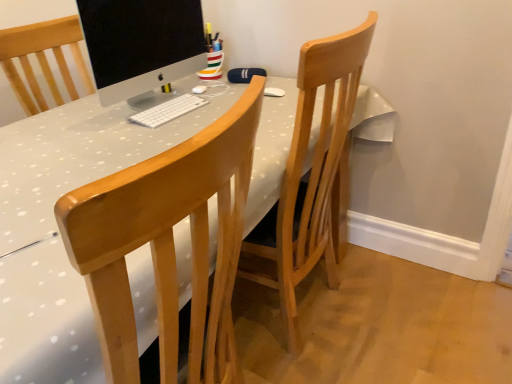
Locate an element on the screen. white matte keyboard at center is located at coordinates [168, 111].

The width and height of the screenshot is (512, 384). What do you see at coordinates (168, 111) in the screenshot? I see `white matte keyboard at center` at bounding box center [168, 111].

You are a GUI agent. You are given a task and a screenshot of the screen. Output one action in this format:
    pyautogui.click(x=<x>, y=<y>)
    Task: Click on the sleek silver monitor at center
    
    Given the screenshot: What is the action you would take?
    pyautogui.click(x=141, y=44)

From the image's perspective, which is below, sleek silver monitor at center or white matte keyboard at center?

white matte keyboard at center is shown below in the image.

Does sleek silver monitor at center appear on the right side of white matte keyboard at center?

No.

Between sleek silver monitor at center and white matte keyboard at center, which one has smaller width?

Thinner between the two is sleek silver monitor at center.

Is point (96, 69) farther from camera compared to point (132, 121)?

That is False.

From the image's perspective, is white matte keyboard at center under wooden chair at center?

No, from the image's perspective, white matte keyboard at center is not beneath wooden chair at center.

I want to click on computer keyboard that is above the wooden chair at center (from the image's perspective), so click(x=168, y=111).

Which is in front, white matte keyboard at center or wooden chair at center?

wooden chair at center is in front.

Is white matte keyboard at center looking in the opposite direction of wooden chair at center?

No, wooden chair at center is not at the back of white matte keyboard at center.

Between wooden chair at center and white matte keyboard at center, which one has smaller width?

Thinner between the two is white matte keyboard at center.

Could you tell me if wooden chair at center is turned towards white matte keyboard at center?

No, wooden chair at center is not turned towards white matte keyboard at center.

How different are the orientations of wooden chair at center and white matte keyboard at center in degrees?

The facing directions of wooden chair at center and white matte keyboard at center are 180 degrees apart.

Consider the image. How much distance is there between wooden chair at center and white matte keyboard at center?

A distance of 30.18 inches exists between wooden chair at center and white matte keyboard at center.

This screenshot has height=384, width=512. What are the coordinates of `computer monitor on the left side of wooden chair at center` in the screenshot? It's located at coord(141,44).

From a real-world perspective, which is physically below, wooden chair at center or sleek silver monitor at center?

In real-world perspective, wooden chair at center is lower.

From the picture: Considering the relative sizes of wooden chair at center and sleek silver monitor at center in the image provided, is wooden chair at center shorter than sleek silver monitor at center?

No.

Considering the relative positions of wooden chair at center and sleek silver monitor at center in the image provided, is wooden chair at center in front of sleek silver monitor at center?

Yes, it is.

From their relative heights in the image, would you say sleek silver monitor at center is taller or shorter than wooden chair at center?

sleek silver monitor at center is shorter than wooden chair at center.

Does sleek silver monitor at center appear on the right side of wooden chair at center?

Incorrect, sleek silver monitor at center is not on the right side of wooden chair at center.

Would you say sleek silver monitor at center is outside wooden chair at center?

Indeed, sleek silver monitor at center is completely outside wooden chair at center.

How different are the orientations of white matte keyboard at center and sleek silver monitor at center in degrees?

They differ by 0.000207 degrees in their facing directions.

Does white matte keyboard at center have a smaller size compared to sleek silver monitor at center?

Yes.

This screenshot has width=512, height=384. Identify the location of computer keyboard on the right of sleek silver monitor at center. (168, 111).

Can you confirm if white matte keyboard at center is wider than sleek silver monitor at center?

Correct, the width of white matte keyboard at center exceeds that of sleek silver monitor at center.

Locate an element on the screen. The height and width of the screenshot is (384, 512). computer keyboard on the right side of sleek silver monitor at center is located at coordinates (168, 111).

Locate an element on the screen. This screenshot has height=384, width=512. computer keyboard that appears on the left of wooden chair at center is located at coordinates (168, 111).

From the image, which object appears to be farther from white matte keyboard at center, sleek silver monitor at center or wooden chair at center?

wooden chair at center is positioned further to the anchor white matte keyboard at center.

Based on their spatial positions, is white matte keyboard at center or sleek silver monitor at center closer to wooden chair at center?

Based on the image, white matte keyboard at center appears to be nearer to wooden chair at center.

Based on the photo, estimate the real-world distances between objects in this image. Which object is further from sleek silver monitor at center, white matte keyboard at center or wooden chair at center?

Based on the image, wooden chair at center appears to be further to sleek silver monitor at center.

Which object lies nearer to the anchor point sleek silver monitor at center, wooden chair at center or white matte keyboard at center?

white matte keyboard at center is closer to sleek silver monitor at center.

Based on their spatial positions, is sleek silver monitor at center or white matte keyboard at center further from wooden chair at center?

sleek silver monitor at center.

Considering their positions, is wooden chair at center positioned further to white matte keyboard at center than sleek silver monitor at center?

wooden chair at center is positioned further to the anchor white matte keyboard at center.

Find the location of `computer monitor between wooden chair at center and white matte keyboard at center in the front-back direction`. computer monitor between wooden chair at center and white matte keyboard at center in the front-back direction is located at coordinates coord(141,44).